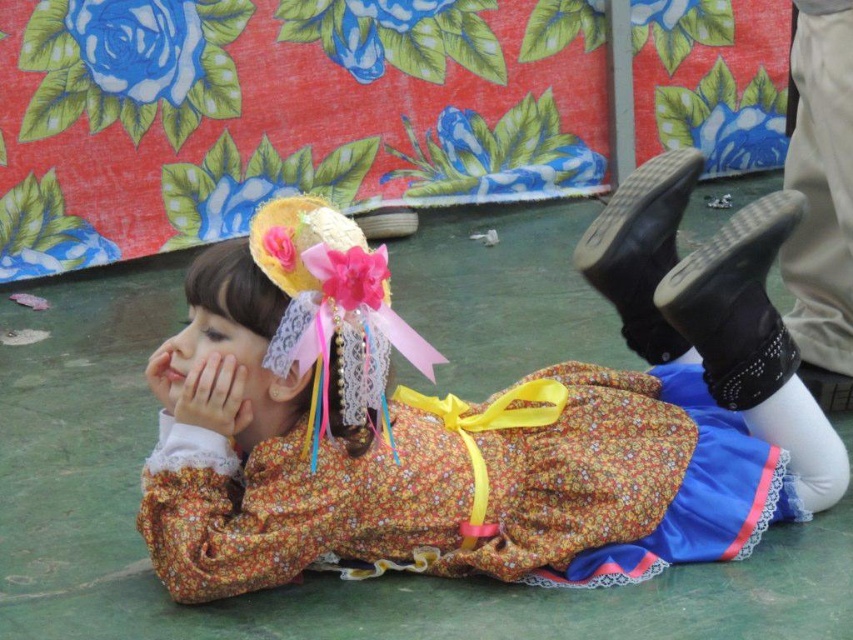
Question: Among these objects, which one is nearest to the camera?

Choices:
 (A) smooth skin face at center
 (B) matte yellow hand at center

Answer: (B)

Question: Which is farther from the floral fabric dress at center?

Choices:
 (A) smooth skin face at center
 (B) matte yellow hand at center

Answer: (A)

Question: Is floral fabric dress at center above matte yellow hand at center?

Choices:
 (A) yes
 (B) no

Answer: (A)

Question: Which point is farther from the camera taking this photo?

Choices:
 (A) (608, 484)
 (B) (172, 404)
 (C) (253, 337)

Answer: (A)

Question: Does floral fabric dress at center appear on the left side of matte yellow hand at center?

Choices:
 (A) no
 (B) yes

Answer: (A)

Question: Is floral fabric dress at center positioned in front of smooth skin face at center?

Choices:
 (A) yes
 (B) no

Answer: (A)